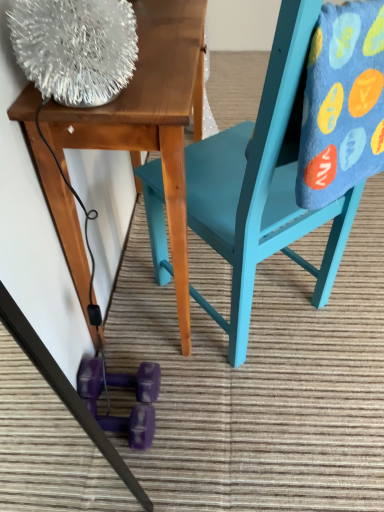
Question: Is wooden table at upper left completely or partially inside purple rubber dumbbell at lower center?

Choices:
 (A) no
 (B) yes

Answer: (A)

Question: Are purple rubber dumbbell at lower center and wooden table at upper left far apart?

Choices:
 (A) no
 (B) yes

Answer: (A)

Question: Considering the relative sizes of purple rubber dumbbell at lower center and wooden table at upper left in the image provided, is purple rubber dumbbell at lower center taller than wooden table at upper left?

Choices:
 (A) no
 (B) yes

Answer: (A)

Question: Is purple rubber dumbbell at lower center positioned with its back to wooden table at upper left?

Choices:
 (A) no
 (B) yes

Answer: (A)

Question: Is purple rubber dumbbell at lower center smaller than wooden table at upper left?

Choices:
 (A) no
 (B) yes

Answer: (B)

Question: In the image, is blue fuzzy blanket at upper right on the left side or the right side of wooden table at upper left?

Choices:
 (A) right
 (B) left

Answer: (A)

Question: Relative to wooden table at upper left, is blue fuzzy blanket at upper right in front or behind?

Choices:
 (A) behind
 (B) front

Answer: (B)

Question: From a real-world perspective, is blue fuzzy blanket at upper right physically located above or below wooden table at upper left?

Choices:
 (A) above
 (B) below

Answer: (A)

Question: Is point (369, 17) positioned closer to the camera than point (11, 117)?

Choices:
 (A) farther
 (B) closer

Answer: (B)

Question: In the image, is teal painted wood chair at center on the left side or the right side of purple rubber dumbbell at lower center?

Choices:
 (A) left
 (B) right

Answer: (B)

Question: In the image, is teal painted wood chair at center positioned in front of or behind purple rubber dumbbell at lower center?

Choices:
 (A) behind
 (B) front

Answer: (B)

Question: From the image's perspective, is teal painted wood chair at center positioned above or below purple rubber dumbbell at lower center?

Choices:
 (A) below
 (B) above

Answer: (B)

Question: Is point click(163, 195) positioned closer to the camera than point click(145, 374)?

Choices:
 (A) closer
 (B) farther

Answer: (A)

Question: From the image's perspective, is purple rubber dumbbell at lower center located above or below wooden table at upper left?

Choices:
 (A) above
 (B) below

Answer: (B)

Question: Would you say purple rubber dumbbell at lower center is to the left or to the right of wooden table at upper left in the picture?

Choices:
 (A) right
 (B) left

Answer: (B)